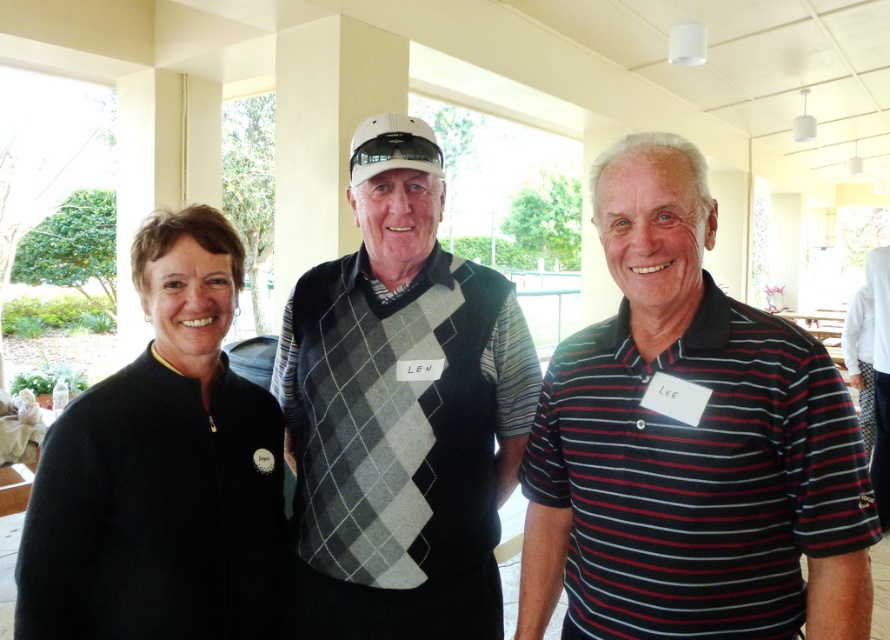
Question: Can you confirm if striped cotton polo shirt at right is wider than black matte jacket at left?

Choices:
 (A) no
 (B) yes

Answer: (B)

Question: Is argyle sweater vest at center bigger than black matte jacket at left?

Choices:
 (A) no
 (B) yes

Answer: (B)

Question: Which point appears closest to the camera in this image?

Choices:
 (A) (346, 404)
 (B) (79, 624)
 (C) (762, 484)

Answer: (C)

Question: Which of the following is the farthest from the observer?

Choices:
 (A) (55, 428)
 (B) (409, 532)
 (C) (654, 458)

Answer: (B)

Question: Is striped cotton polo shirt at right smaller than black matte jacket at left?

Choices:
 (A) yes
 (B) no

Answer: (B)

Question: Which of the following is the closest to the observer?

Choices:
 (A) (723, 573)
 (B) (435, 392)

Answer: (A)